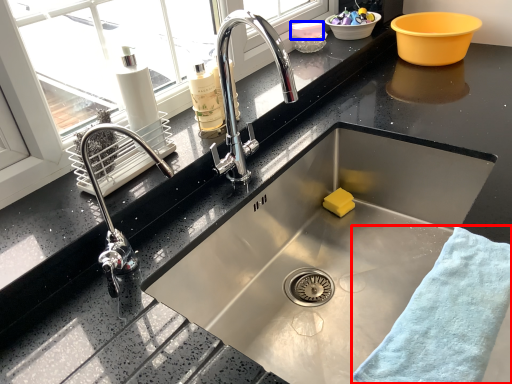
Question: Which of the following is the farthest to the observer, bath towel (highlighted by a red box) or basin (highlighted by a blue box)?

Choices:
 (A) bath towel
 (B) basin

Answer: (B)